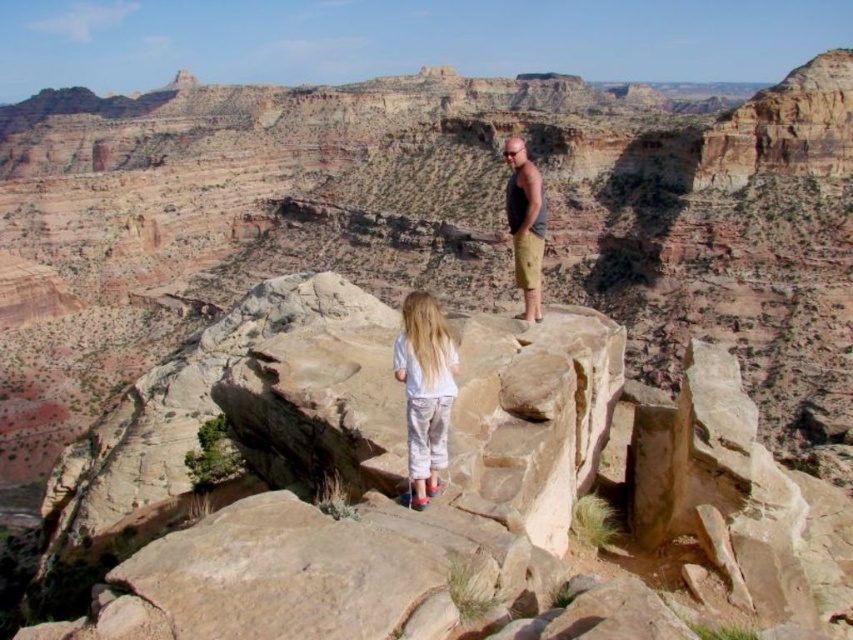
Does light blue cotton shirt at center come behind matte black tank top at center?

That is False.

Which of these two, light blue cotton shirt at center or matte black tank top at center, stands taller?

matte black tank top at center is taller.

Measure the distance between point (436, 400) and camera.

Point (436, 400) and camera are 31.91 meters apart from each other.

The height and width of the screenshot is (640, 853). Find the location of `light blue cotton shirt at center`. light blue cotton shirt at center is located at coordinates (425, 390).